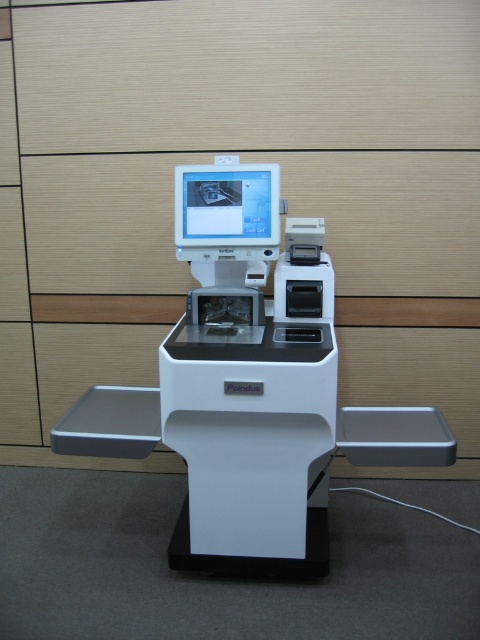
Question: Is white plastic machine at center bigger than matte white monitor at center?

Choices:
 (A) yes
 (B) no

Answer: (A)

Question: Considering the relative positions of white plastic machine at center and matte white monitor at center in the image provided, where is white plastic machine at center located with respect to matte white monitor at center?

Choices:
 (A) right
 (B) left

Answer: (A)

Question: Which point appears closest to the camera in this image?

Choices:
 (A) (236, 381)
 (B) (239, 220)

Answer: (A)

Question: Does white plastic machine at center have a greater width compared to matte white monitor at center?

Choices:
 (A) yes
 (B) no

Answer: (A)